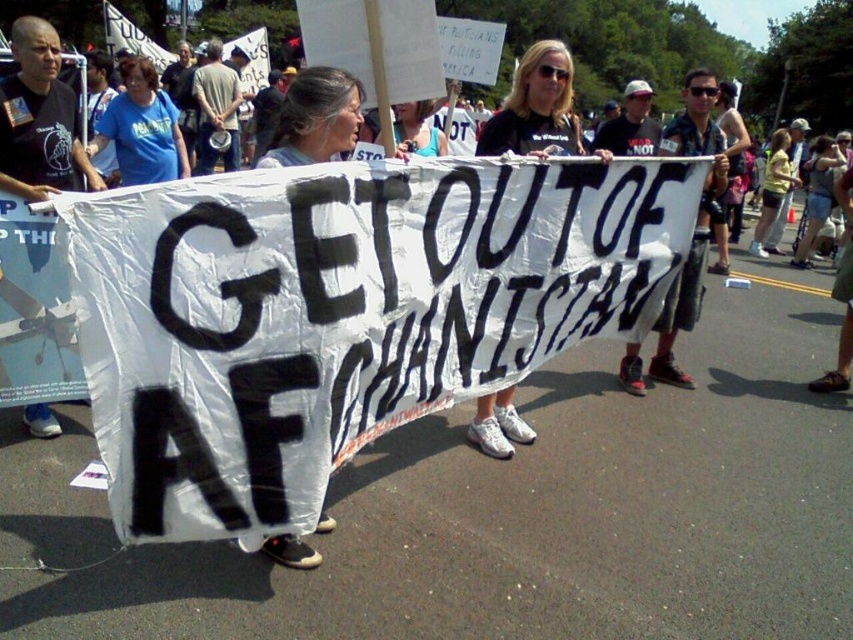
You are a photographer at the protest scene. You want to take a photo of the gray fabric shirt at center. Where should you aim your camera to capture it?

The gray fabric shirt at center is located at point 0.186 on the x axis and 0.370 on the y axis, so you should aim your camera at those coordinates to capture it.

Consider the image. You are a photographer trying to capture the matte white banner at center in your shot. There is a person wearing a gray fabric shirt at center blocking your view. Can you estimate if the banner is taller than the person blocking it?

The matte white banner at center is taller than the gray fabric shirt at center, so yes, the banner is taller than the person blocking it, meaning you can still capture most of the banner above the person.